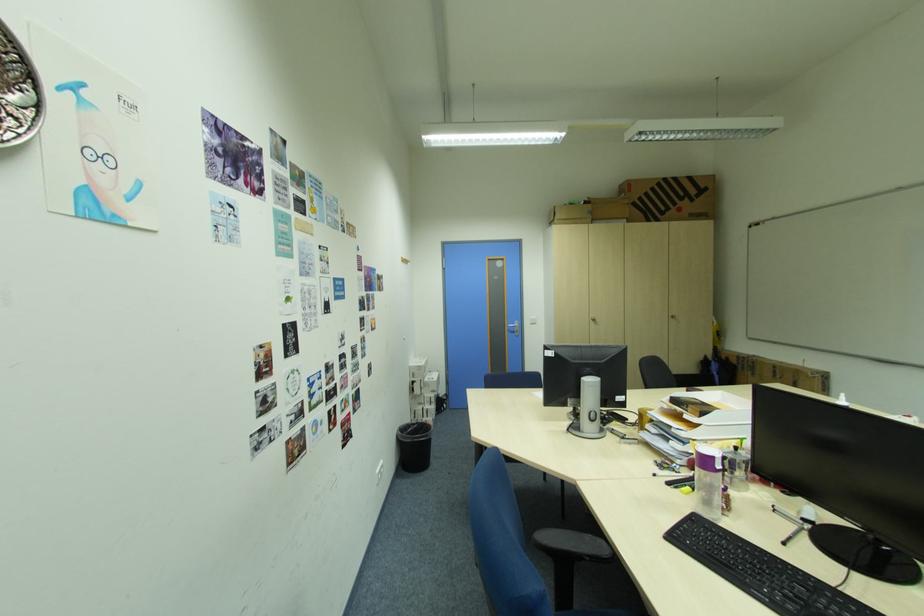
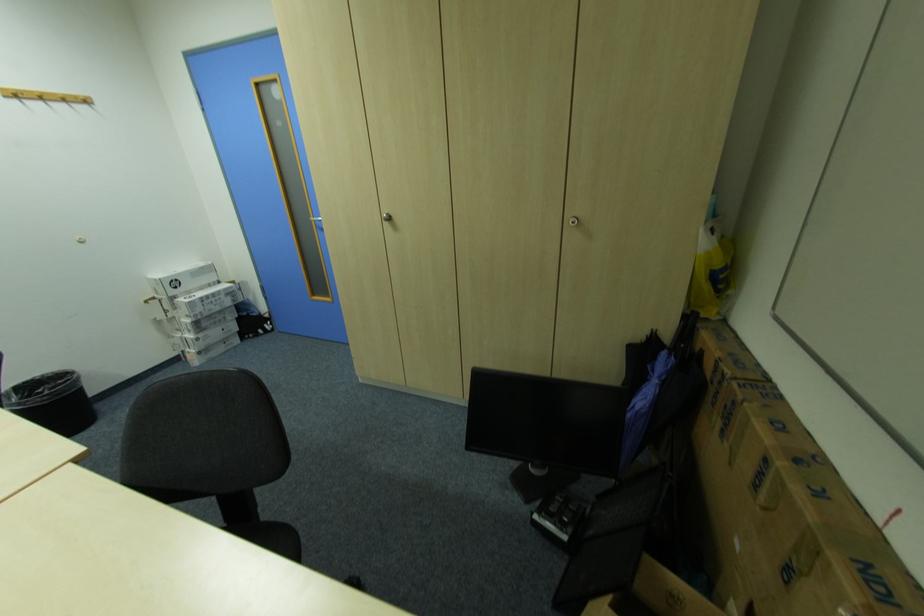
The point at (787, 379) is marked in the first image. Where is the corresponding point in the second image?

(772, 509)